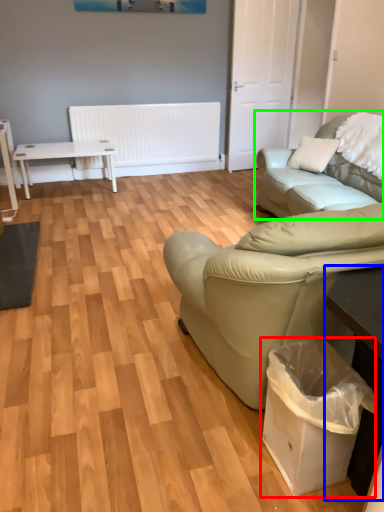
Question: Which is farther away from garbage (highlighted by a red box)? table (highlighted by a blue box) or studio couch (highlighted by a green box)?

Choices:
 (A) table
 (B) studio couch

Answer: (B)